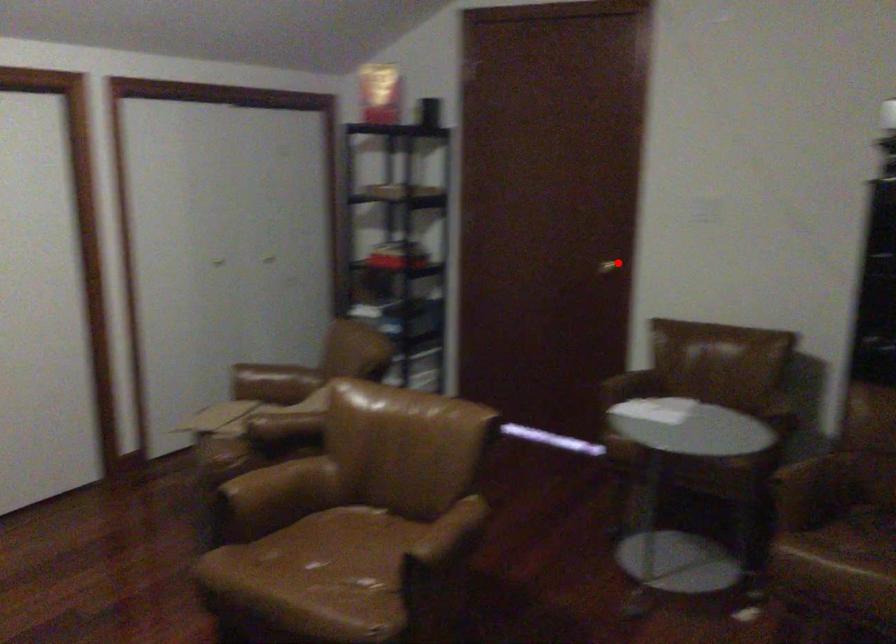
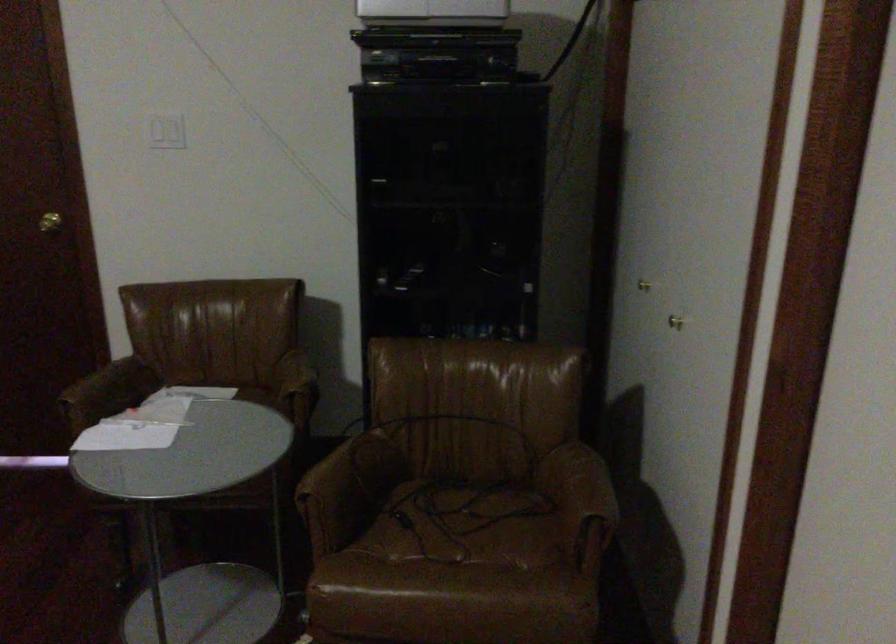
Question: I am providing you with two images of the same scene from different viewpoints. Given a red point in image1, look at the same physical point in image2. Is it:

Choices:
 (A) Closer to the viewpoint
 (B) Farther from the viewpoint

Answer: (A)